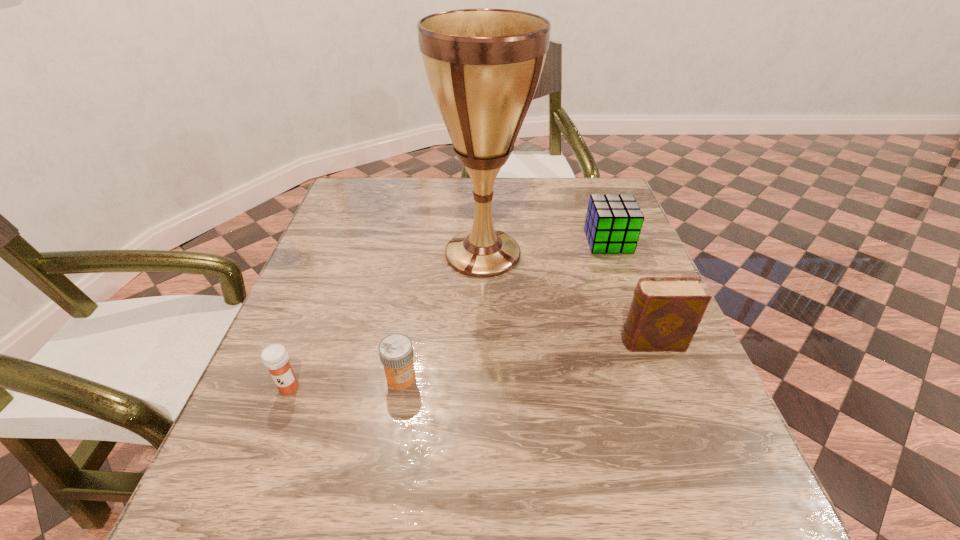
I want to click on trophy cup, so click(x=483, y=65).

Locate an element on the screen. Image resolution: width=960 pixels, height=540 pixels. the third object from left to right is located at coordinates (483, 65).

I want to click on the fourth shortest object, so click(x=665, y=312).

Locate an element on the screen. diary is located at coordinates (665, 312).

In order to click on cube in this screenshot , I will do `click(613, 223)`.

The width and height of the screenshot is (960, 540). I want to click on the left medicine, so click(x=275, y=358).

The width and height of the screenshot is (960, 540). I want to click on the right medicine, so click(x=396, y=354).

The height and width of the screenshot is (540, 960). What are the coordinates of `free space located on the left of the tallest object` in the screenshot? It's located at (326, 254).

Image resolution: width=960 pixels, height=540 pixels. I want to click on free space located 0.310m on the spine side of the third farthest object, so click(x=465, y=342).

Locate an element on the screen. The image size is (960, 540). free location located on the spine side of the third farthest object is located at coordinates (449, 342).